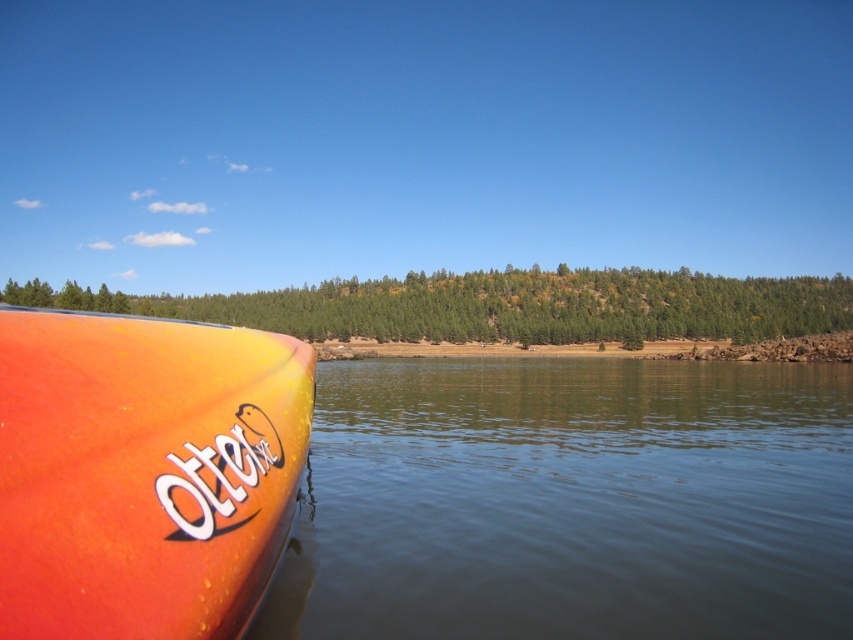
Is clear water at lower left taller than orange matte kayak at lower left?

Yes, clear water at lower left is taller than orange matte kayak at lower left.

Where is `clear water at lower left`? The height and width of the screenshot is (640, 853). clear water at lower left is located at coordinates (x=572, y=500).

Consider the image. Is orange matte kayak at lower left shorter than green matte tree at center?

Yes, orange matte kayak at lower left is shorter than green matte tree at center.

Between orange matte kayak at lower left and green matte tree at center, which one has more height?

Standing taller between the two is green matte tree at center.

Where is `orange matte kayak at lower left`? The height and width of the screenshot is (640, 853). orange matte kayak at lower left is located at coordinates (143, 472).

Between clear water at lower left and green matte tree at center, which one appears on the right side from the viewer's perspective?

green matte tree at center

Who is more forward, (709, 499) or (38, 292)?

Positioned in front is point (709, 499).

Where is `clear water at lower left`? clear water at lower left is located at coordinates (572, 500).